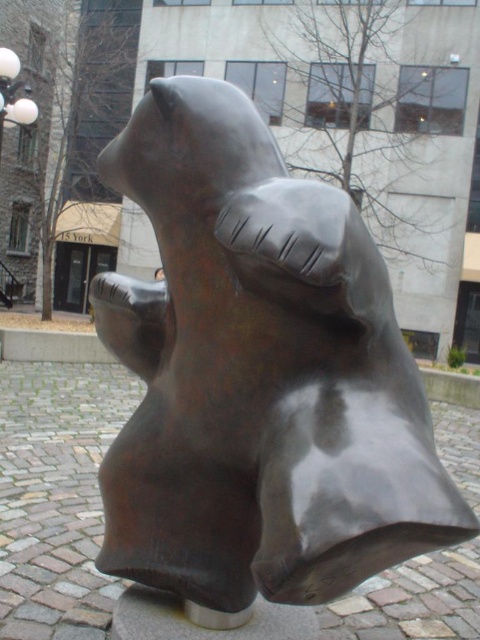
You are a city planner assessing the plaza layout. The bronze bear at center and the white glass lamp post at upper left are both in the plaza. Which of these two objects has a smaller width?

The bronze bear at center is thinner than the white glass lamp post at upper left, so the bronze bear at center has a smaller width.

You are an art student observing the bronze bear at center and the white glass lamp post at upper left in the plaza. Which object is taller?

The bronze bear at center has a lesser height compared to the white glass lamp post at upper left, so the white glass lamp post at upper left is taller.